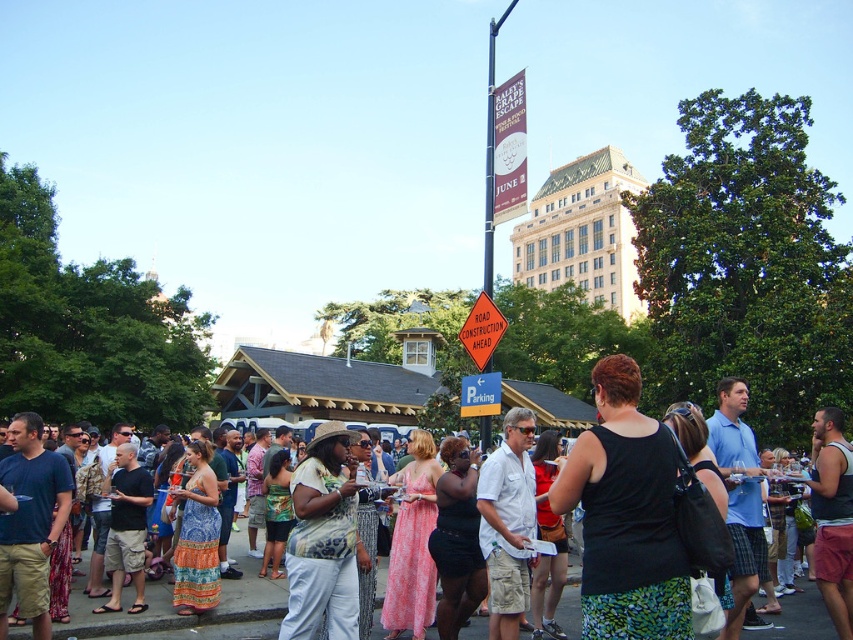
You are standing at the origin point of the coordinate system in this image. You want to find the matte black dress at center. In which direction should you move to reach it?

The matte black dress at center is located at coordinate point 0.966 on the x axis and 0.219 on the y axis. Since you are at the origin, you should move in the positive x direction and slightly positive y direction to reach it.